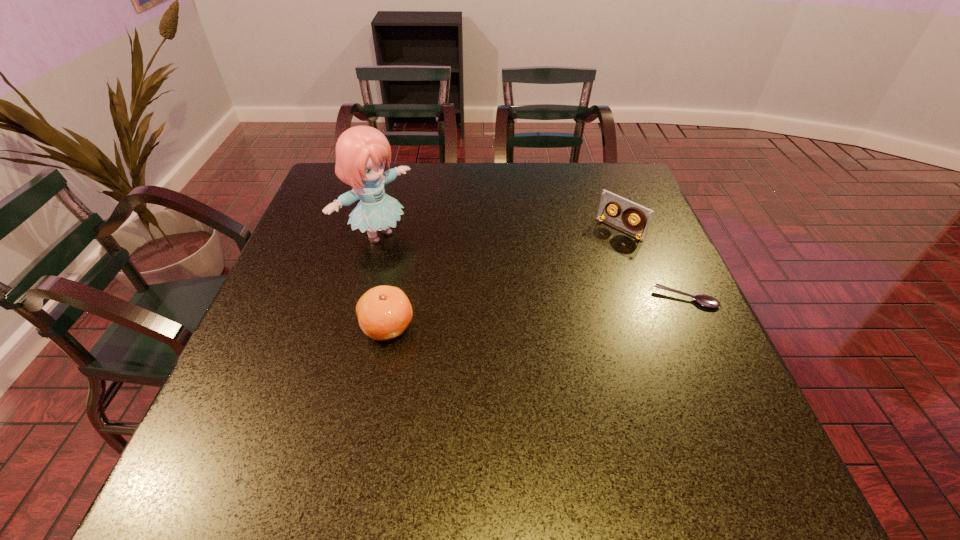
Image resolution: width=960 pixels, height=540 pixels. Find the location of `vacant space situated 0.370m at the front of the videotape with visible reels`. vacant space situated 0.370m at the front of the videotape with visible reels is located at coordinates (518, 315).

Where is `free space located at the front of the videotape with visible reels`? The height and width of the screenshot is (540, 960). free space located at the front of the videotape with visible reels is located at coordinates (551, 287).

This screenshot has width=960, height=540. I want to click on object situated at the left edge, so click(x=361, y=152).

This screenshot has height=540, width=960. What are the coordinates of `soupspoon that is positioned at the right edge` in the screenshot? It's located at (705, 300).

I want to click on videotape positioned at the right edge, so click(x=643, y=215).

The image size is (960, 540). Find the location of `vacant space at the far edge of the desktop`. vacant space at the far edge of the desktop is located at coordinates [x=515, y=168].

The height and width of the screenshot is (540, 960). Identify the location of free space at the near edge of the desktop. (348, 428).

Locate an element on the screen. The height and width of the screenshot is (540, 960). vacant point at the left edge is located at coordinates (315, 262).

In the image, there is a desktop. Identify the location of vacant space at the far left corner. The height and width of the screenshot is (540, 960). (312, 201).

The height and width of the screenshot is (540, 960). What are the coordinates of `free spot at the far right corner of the desktop` in the screenshot? It's located at (587, 170).